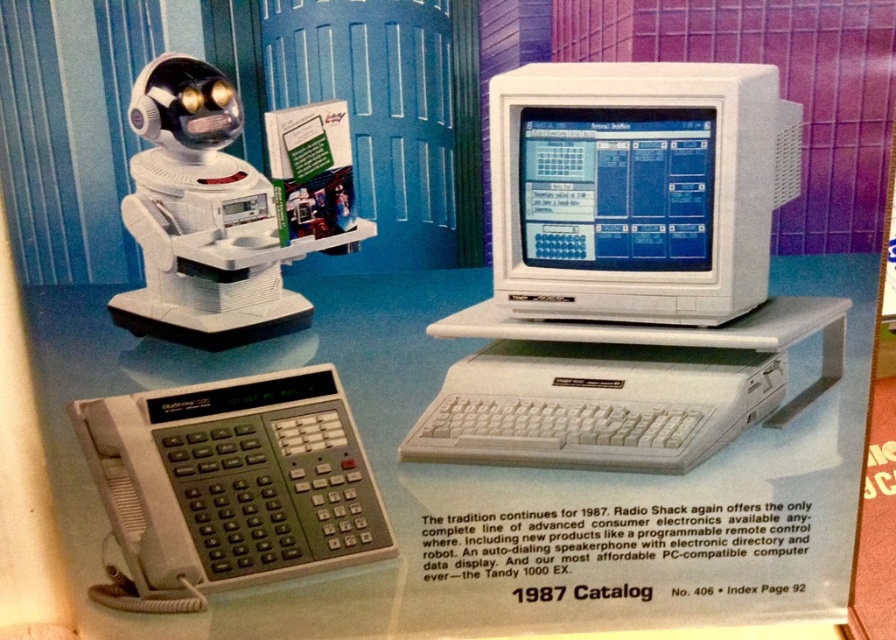
Question: Which object is the farthest from the blue glossy monitor at center?

Choices:
 (A) white plastic desktop computer at center
 (B) white plastic monitor at center

Answer: (A)

Question: Is white plastic monitor at center smaller than blue glossy monitor at center?

Choices:
 (A) no
 (B) yes

Answer: (A)

Question: Does white plastic monitor at center appear on the right side of blue glossy monitor at center?

Choices:
 (A) yes
 (B) no

Answer: (A)

Question: Considering the real-world distances, which object is closest to the blue glossy monitor at center?

Choices:
 (A) white plastic desktop computer at center
 (B) white plastic monitor at center

Answer: (B)

Question: Which of these objects is positioned farthest from the white plastic monitor at center?

Choices:
 (A) white plastic desktop computer at center
 (B) blue glossy monitor at center

Answer: (A)

Question: Can you confirm if white plastic monitor at center is wider than blue glossy monitor at center?

Choices:
 (A) no
 (B) yes

Answer: (B)